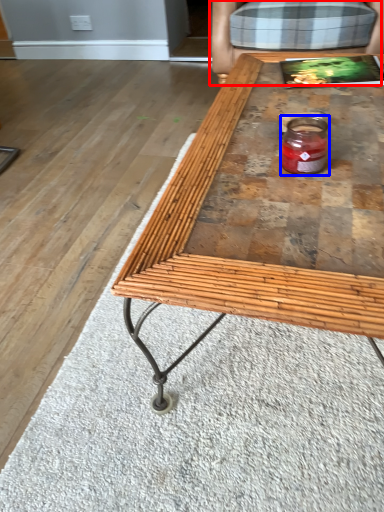
Question: Among these objects, which one is nearest to the camera, armchair (highlighted by a red box) or glass jar (highlighted by a blue box)?

Choices:
 (A) armchair
 (B) glass jar

Answer: (B)